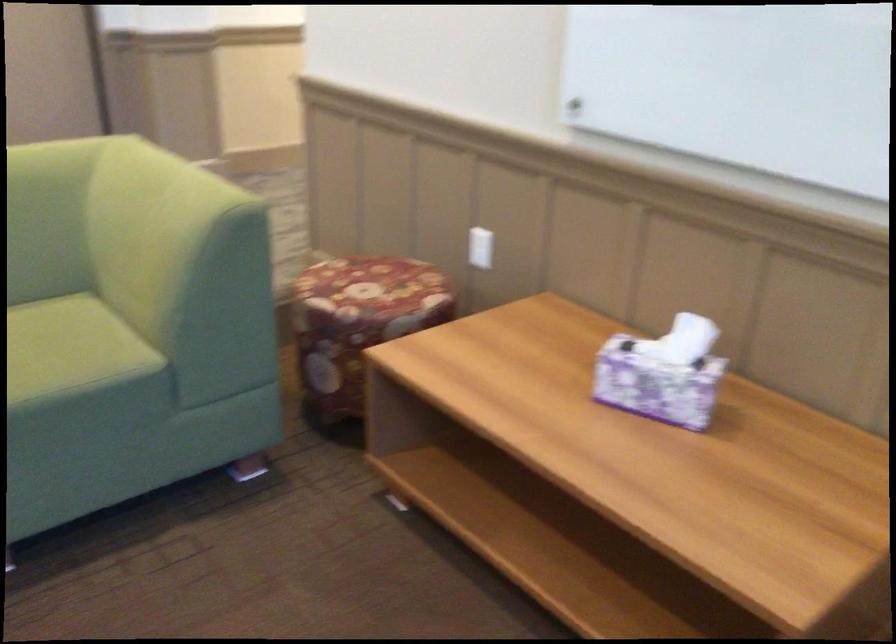
This screenshot has width=896, height=644. Find the location of `green sofa armrest`. green sofa armrest is located at coordinates (181, 184).